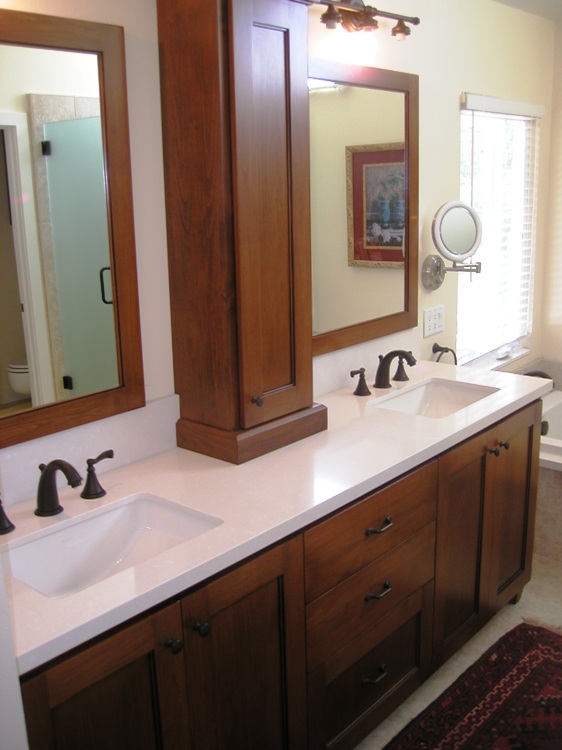
I want to click on cabinet doors, so click(249, 615), click(130, 679), click(470, 506), click(513, 489).